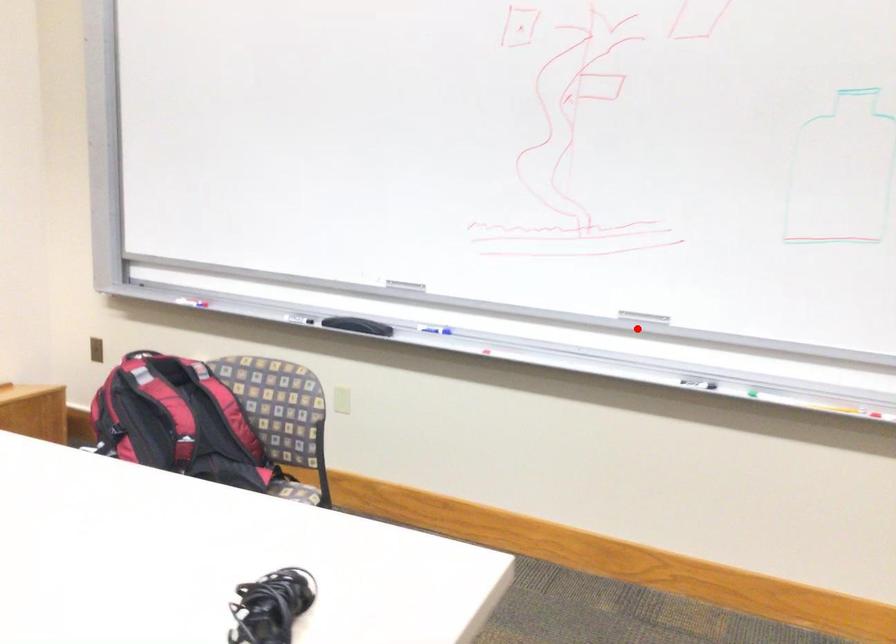
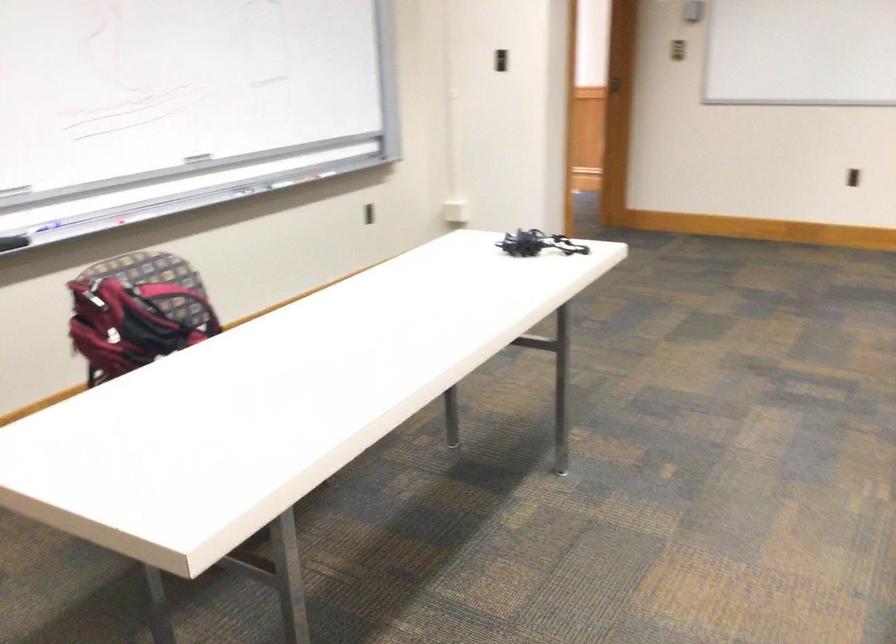
Where in the second image is the point corresponding to the highlighted location from the first image?

(193, 164)